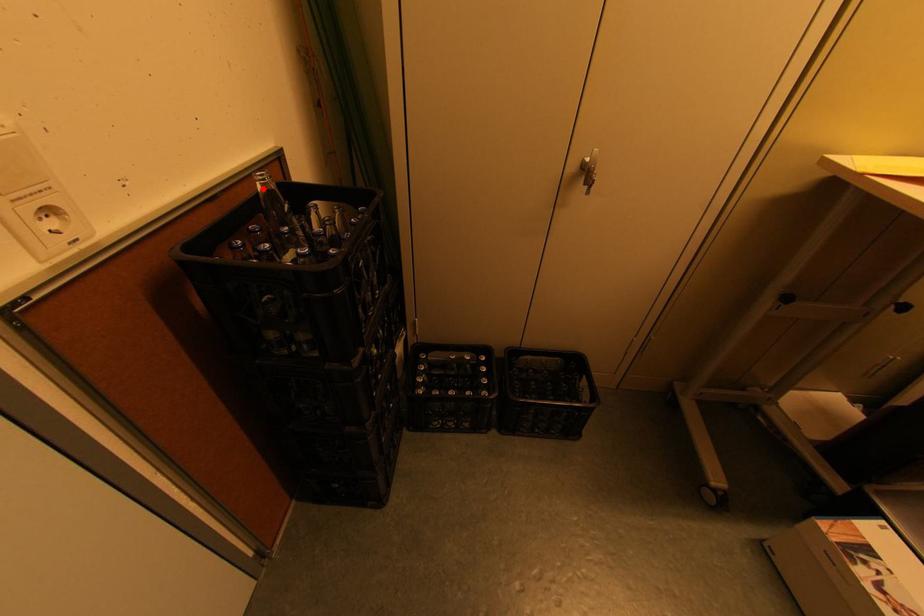
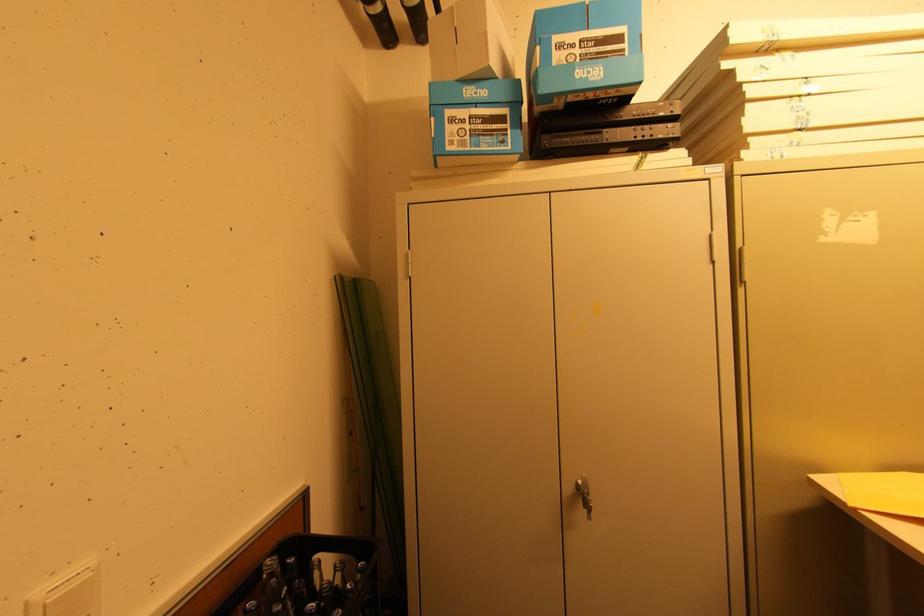
Where in the second image is the point corresponding to the highlighted location from the first image?

(268, 578)